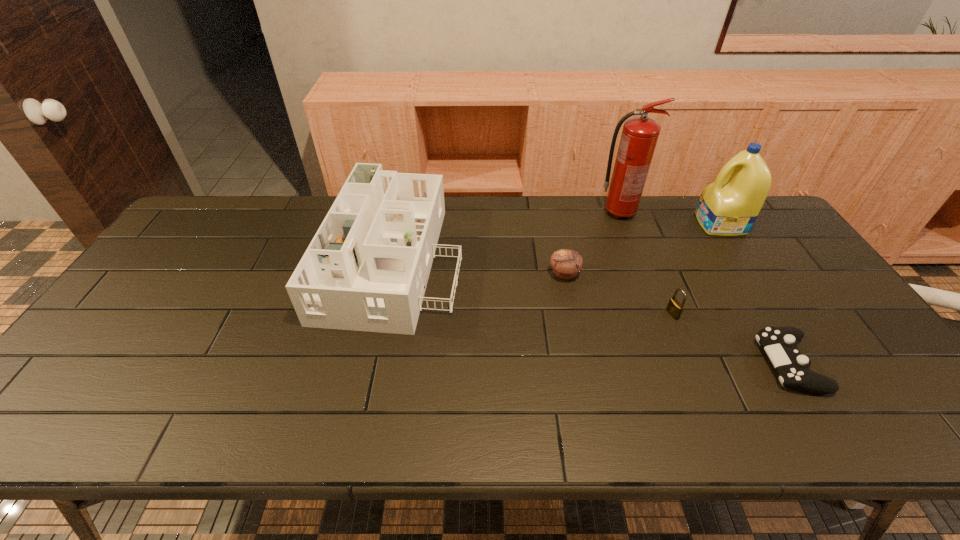
At what (x,y) coordinates should I click in order to perform the action: click on free region located on the label of the fifth shortest object. Please return your answer as a coordinate pair (x, y). The width and height of the screenshot is (960, 540). Looking at the image, I should click on (637, 224).

Locate an element on the screen. This screenshot has width=960, height=540. free space located on the left of the dollhouse is located at coordinates (252, 256).

You are a GUI agent. You are given a task and a screenshot of the screen. Output one action in this format:
    pyautogui.click(x=<x>, y=<y>)
    Task: Click on the blank space located 0.270m on the right of the padlock
    The height and width of the screenshot is (540, 960).
    Given the screenshot: What is the action you would take?
    pyautogui.click(x=779, y=314)

Locate an element on the screen. free space located on the back of the muffin is located at coordinates (551, 206).

The height and width of the screenshot is (540, 960). Identify the location of free spot located 0.070m on the surface of the shortest object. (734, 364).

Where is `free spot located 0.090m on the surface of the shortest object`? The width and height of the screenshot is (960, 540). free spot located 0.090m on the surface of the shortest object is located at coordinates (726, 364).

Locate an element on the screen. The image size is (960, 540). vacant area located on the surface of the shortest object is located at coordinates (701, 364).

Where is `fire extinguisher present at the far edge`? fire extinguisher present at the far edge is located at coordinates (639, 137).

At what (x,y) coordinates should I click in order to perform the action: click on detergent present at the far edge. Please return your answer as a coordinate pair (x, y). The image size is (960, 540). Looking at the image, I should click on (729, 206).

The height and width of the screenshot is (540, 960). What are the coordinates of `dollhouse situated at the far edge` in the screenshot? It's located at pos(366,269).